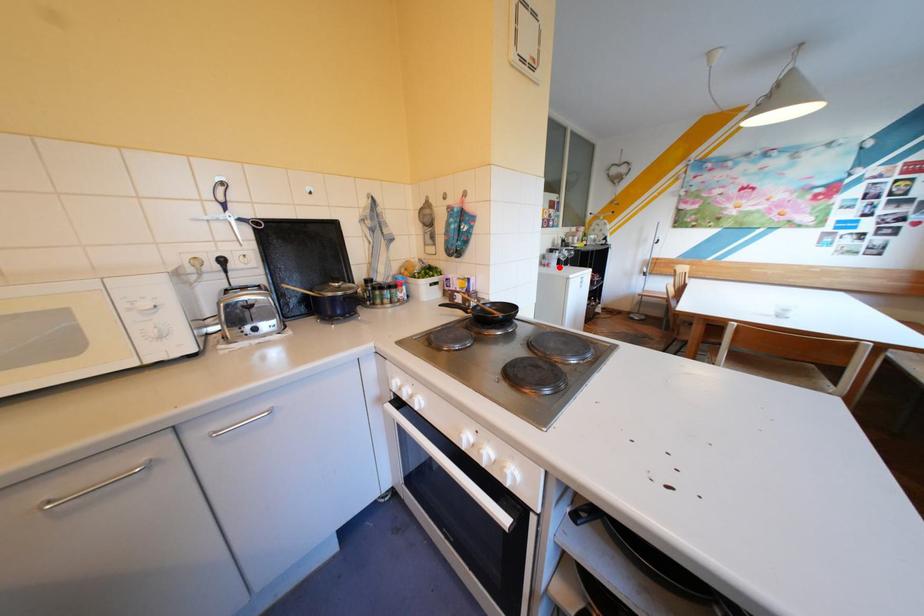
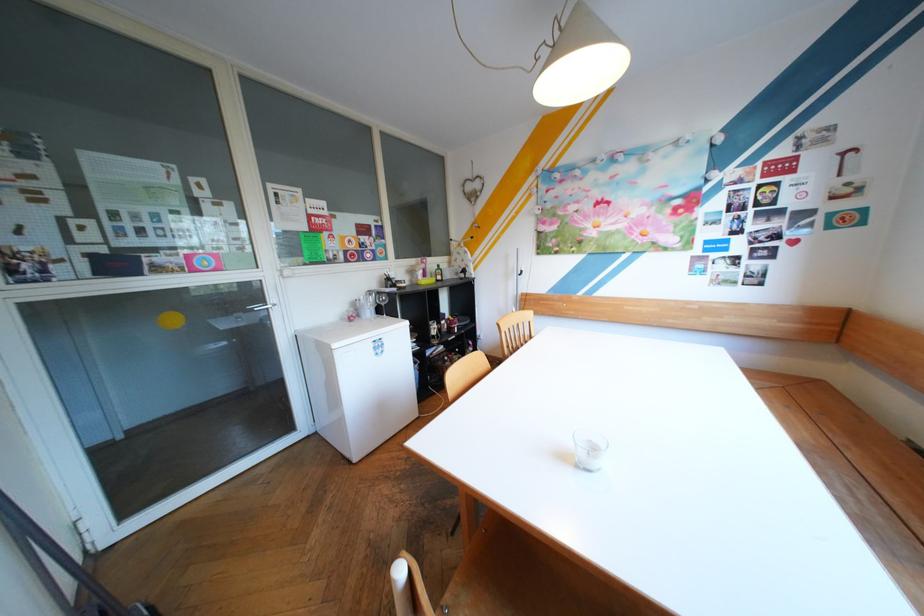
The point at the highlighted location is marked in the first image. Where is the corresponding point in the second image?

(360, 322)